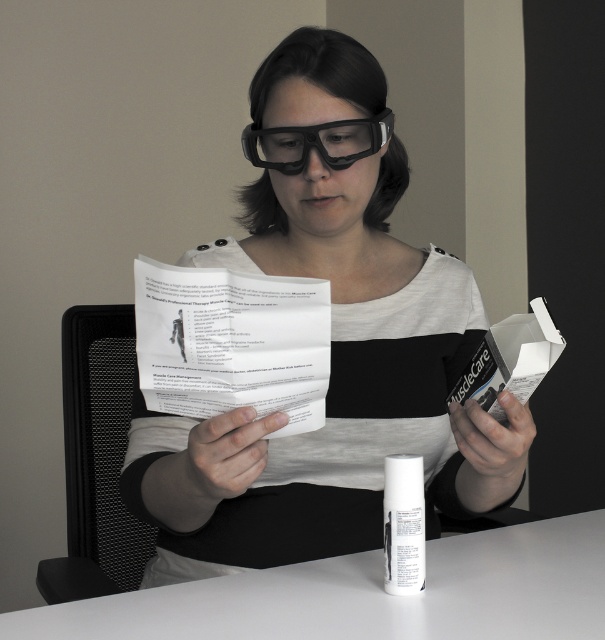
Looking at this image, who is higher up, matte black glasses at upper center or white matte table at center?

matte black glasses at upper center

Who is positioned more to the right, matte black glasses at upper center or white matte table at center?

From the viewer's perspective, white matte table at center appears more on the right side.

I want to click on matte black glasses at upper center, so click(x=330, y=392).

Locate an element on the screen. matte black glasses at upper center is located at coordinates (330, 392).

Is matte black glasses at upper center positioned before transparent plastic glasses at center?

Yes, matte black glasses at upper center is in front of transparent plastic glasses at center.

Is point (388, 317) behind point (260, 141)?

Yes, it is.

At what (x,y) coordinates should I click in order to perform the action: click on matte black glasses at upper center. Please return your answer as a coordinate pair (x, y). This screenshot has width=605, height=640. Looking at the image, I should click on (330, 392).

Is white matte table at center thinner than transparent plastic glasses at center?

In fact, white matte table at center might be wider than transparent plastic glasses at center.

Does white matte table at center have a lesser height compared to transparent plastic glasses at center?

Indeed, white matte table at center has a lesser height compared to transparent plastic glasses at center.

Between point (586, 557) and point (335, 145), which one is positioned in front?

Point (586, 557)

Where is `white matte table at center`? white matte table at center is located at coordinates (370, 595).